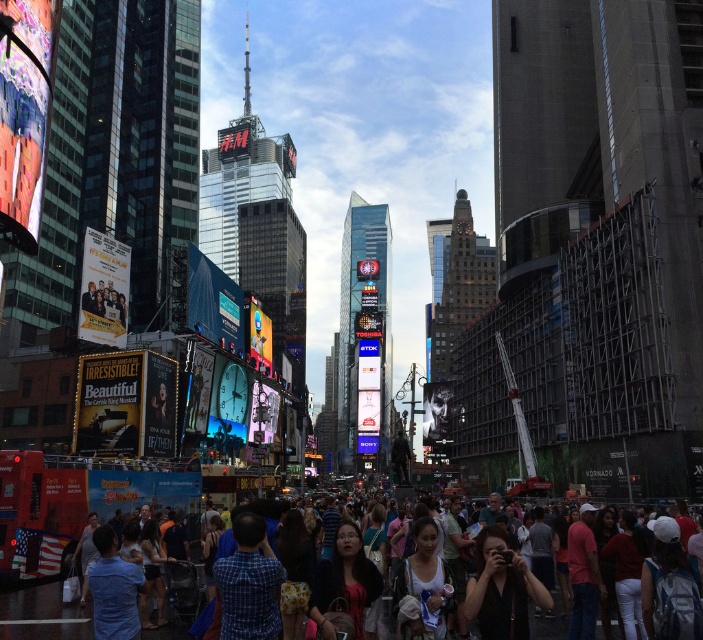
You are a photographer planning to capture a candid shot of the blue plaid shirt at center and the multicolored casual attire at center in Times Square. Which person should you focus on first if you want to photograph the taller individual?

The multicolored casual attire at center is taller than the blue plaid shirt at center, so you should focus on the multicolored casual attire at center first.

In the bustling urban scene of Times Square, there is a point marked at coordinates (247, 582). What object or feature is located at this specific coordinate?

The point at coordinates (247, 582) corresponds to the blue plaid shirt at center.

You are a photographer trying to capture a candid shot of the crowd in Times Square. You notice two individuals wearing a blue plaid shirt at center and a multicolored casual attire at center. Which person would require a wider lens to capture their entire outfit in the frame?

The multicolored casual attire at center requires a wider lens because it is wider than the blue plaid shirt at center.